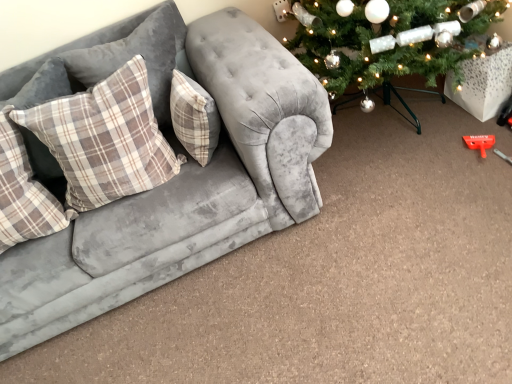
Question: From a real-world perspective, is velvet grey couch at left above or below plaid fabric pillow at center, the first pillow in the right-to-left sequence?

Choices:
 (A) above
 (B) below

Answer: (B)

Question: Considering the positions of velvet grey couch at left and plaid fabric pillow at center, placed as the 4th pillow when sorted from left to right, in the image, is velvet grey couch at left taller or shorter than plaid fabric pillow at center, placed as the 4th pillow when sorted from left to right,?

Choices:
 (A) short
 (B) tall

Answer: (B)

Question: Estimate the real-world distances between objects in this image. Which object is farther from the plaid fabric pillow at left, positioned as the second pillow in left-to-right order?

Choices:
 (A) velvet grey couch at left
 (B) plaid fabric pillow at left, which appears as the 3th pillow when viewed from the left
 (C) plaid fabric pillow at left, which appears as the 4th pillow when viewed from the right
 (D) plaid fabric pillow at center, the first pillow in the right-to-left sequence

Answer: (B)

Question: Estimate the real-world distances between objects in this image. Which object is closer to the plaid fabric pillow at left, the 3th pillow in the right-to-left sequence?

Choices:
 (A) plaid fabric pillow at left, acting as the 1th pillow starting from the left
 (B) velvet grey couch at left
 (C) plaid fabric pillow at center, the first pillow in the right-to-left sequence
 (D) plaid fabric pillow at left, the second pillow positioned from the right

Answer: (C)